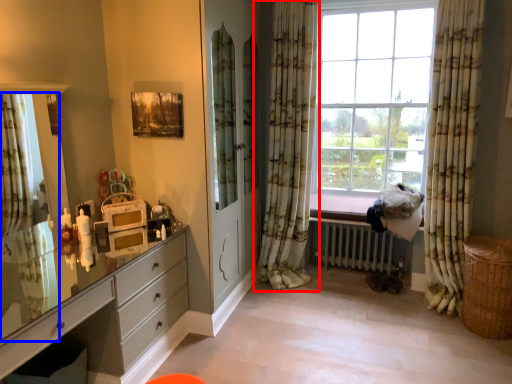
Question: Which object is closer to the camera taking this photo, curtain (highlighted by a red box) or curtain (highlighted by a blue box)?

Choices:
 (A) curtain
 (B) curtain

Answer: (B)